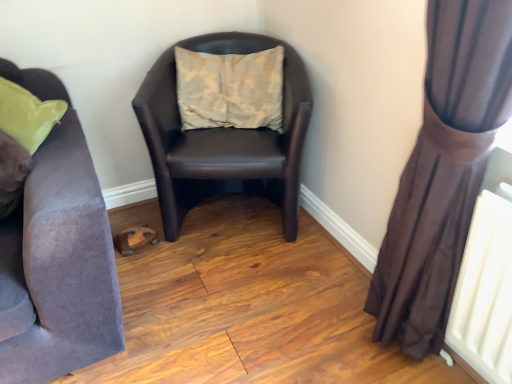
Question: Considering the relative positions of beige fabric pillow at center and brown sheer curtain at right in the image provided, is beige fabric pillow at center to the left or to the right of brown sheer curtain at right?

Choices:
 (A) right
 (B) left

Answer: (B)

Question: From the image's perspective, is beige fabric pillow at center above or below brown sheer curtain at right?

Choices:
 (A) above
 (B) below

Answer: (A)

Question: Considering the real-world distances, which object is closest to the velvet purple couch at left?

Choices:
 (A) brown leather chair at center
 (B) brown sheer curtain at right
 (C) beige fabric pillow at center

Answer: (A)

Question: Considering the real-world distances, which object is closest to the brown leather chair at center?

Choices:
 (A) brown sheer curtain at right
 (B) velvet purple couch at left
 (C) beige fabric pillow at center

Answer: (C)